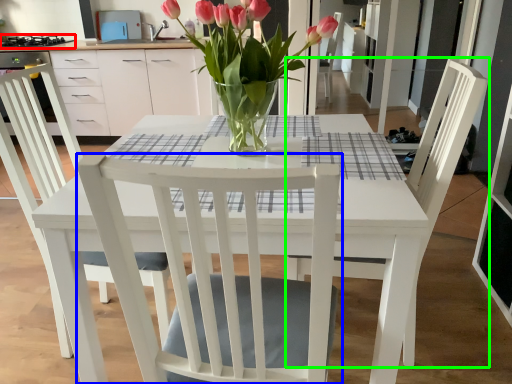
Question: Which object is positioned farthest from appliance (highlighted by a red box)? Select from chair (highlighted by a blue box) and chair (highlighted by a green box).

Choices:
 (A) chair
 (B) chair

Answer: (A)